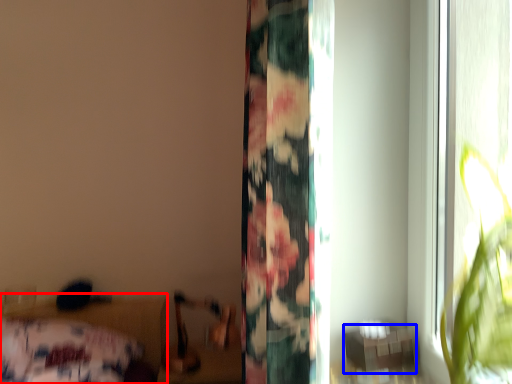
Question: Among these objects, which one is nearest to the camera, bed (highlighted by a red box) or table (highlighted by a blue box)?

Choices:
 (A) bed
 (B) table

Answer: (B)